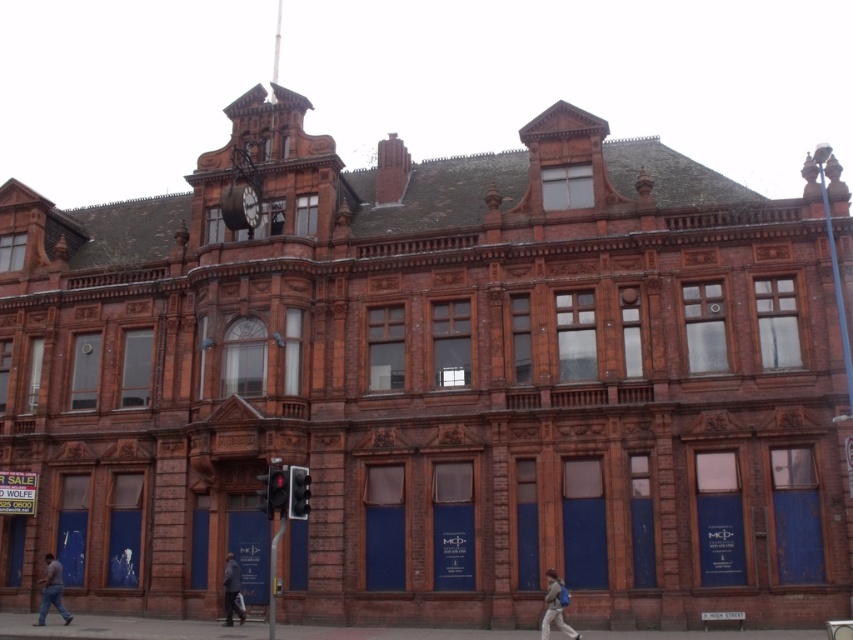
Question: Can you confirm if matte gray jacket at lower right is positioned to the right of metallic clock at upper center?

Choices:
 (A) yes
 (B) no

Answer: (A)

Question: Which point is farther to the camera?

Choices:
 (A) matte brown clock at upper center
 (B) dark brown leather coat at lower center
 (C) blue jeans at lower left

Answer: (A)

Question: Which point is closer to the camera?

Choices:
 (A) (546, 596)
 (B) (234, 584)

Answer: (A)

Question: Which point is closer to the camera taking this photo?

Choices:
 (A) (563, 605)
 (B) (254, 211)

Answer: (A)

Question: Can you confirm if dark brown leather coat at lower center is thinner than metallic clock at upper center?

Choices:
 (A) no
 (B) yes

Answer: (A)

Question: Can you confirm if matte gray jacket at lower right is bigger than metallic clock at upper center?

Choices:
 (A) yes
 (B) no

Answer: (A)